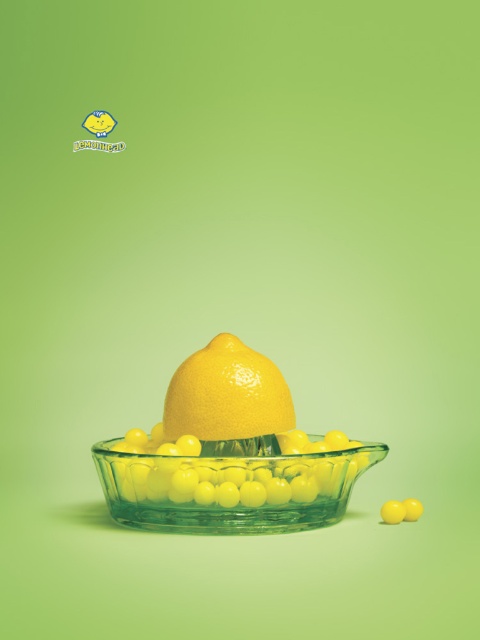
Is transparent glass bowl at center taller than glossy citrus fruit at center?

In fact, transparent glass bowl at center may be shorter than glossy citrus fruit at center.

Which is below, transparent glass bowl at center or glossy citrus fruit at center?

transparent glass bowl at center is below.

The image size is (480, 640). Describe the element at coordinates (230, 490) in the screenshot. I see `transparent glass bowl at center` at that location.

You are a GUI agent. You are given a task and a screenshot of the screen. Output one action in this format:
    pyautogui.click(x=<x>, y=<y>)
    Task: Click on the transparent glass bowl at center
    
    Given the screenshot: What is the action you would take?
    pyautogui.click(x=230, y=490)